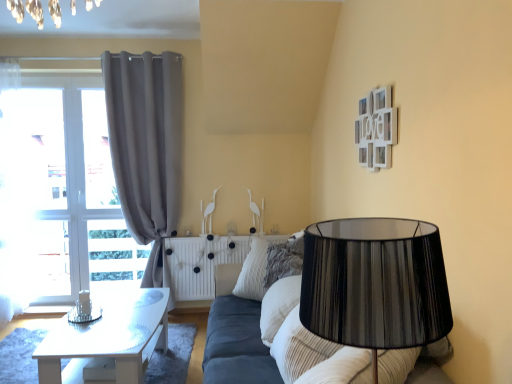
Identify the location of free space above white glossy table at left (from a real-world perspective). (109, 323).